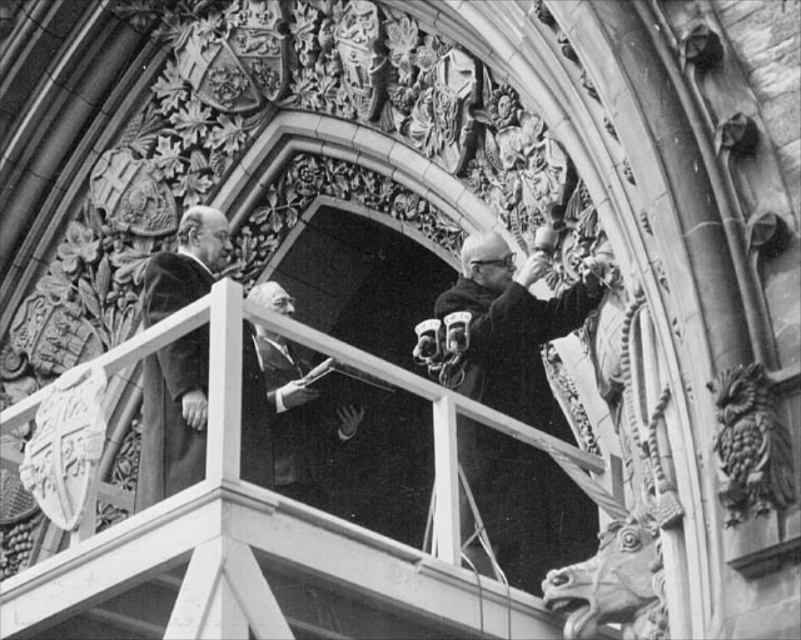
Who is more forward, (135, 515) or (199, 435)?

Positioned in front is point (135, 515).

You are a GUI agent. You are given a task and a screenshot of the screen. Output one action in this format:
    pyautogui.click(x=<x>, y=<y>)
    Task: Click on the smooth wood balcony at center
    The height and width of the screenshot is (640, 801).
    Given the screenshot: What is the action you would take?
    pyautogui.click(x=274, y=529)

Does point (206, 538) lie in front of point (192, 346)?

Yes, it is.

Locate an element on the screen. smooth wood balcony at center is located at coordinates (274, 529).

Can you confirm if smooth wood balcony at center is smaller than smooth black suit at center?

Actually, smooth wood balcony at center might be larger than smooth black suit at center.

This screenshot has width=801, height=640. What do you see at coordinates (274, 529) in the screenshot? I see `smooth wood balcony at center` at bounding box center [274, 529].

Is point (310, 557) closer to viewer compared to point (276, 461)?

Yes, point (310, 557) is in front of point (276, 461).

Locate an element on the screen. smooth wood balcony at center is located at coordinates (274, 529).

Between velvet-like brown coat at left and smooth black suit at center, which one has more height?

velvet-like brown coat at left

Does velvet-like brown coat at left appear under smooth black suit at center?

No.

Where is `velvet-like brown coat at left`? Image resolution: width=801 pixels, height=640 pixels. velvet-like brown coat at left is located at coordinates (172, 417).

Identify the location of velvet-like brown coat at left. This screenshot has height=640, width=801. (172, 417).